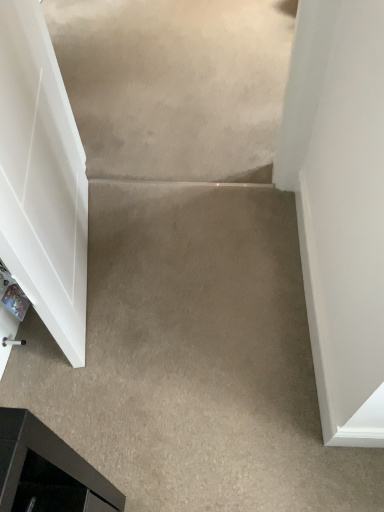
Question: Should I look upward or downward to see white glossy door at left?

Choices:
 (A) down
 (B) up

Answer: (B)